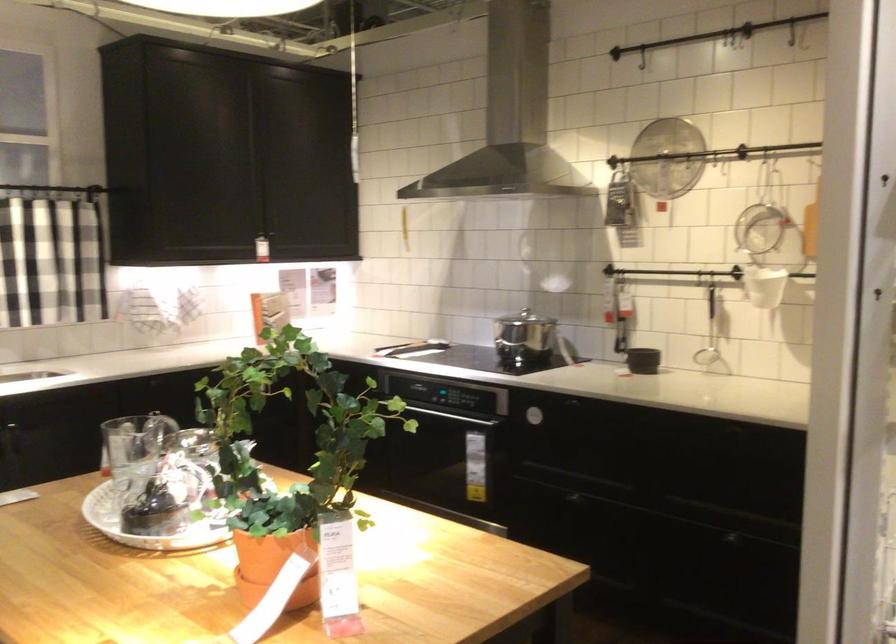
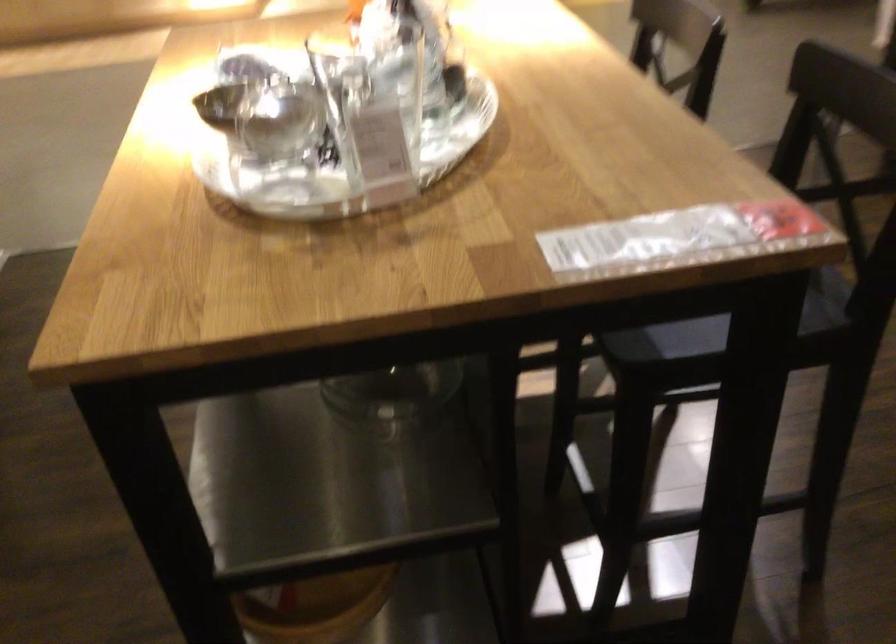
Find the pixel in the second image that matches [154,478] in the first image.

(371, 29)